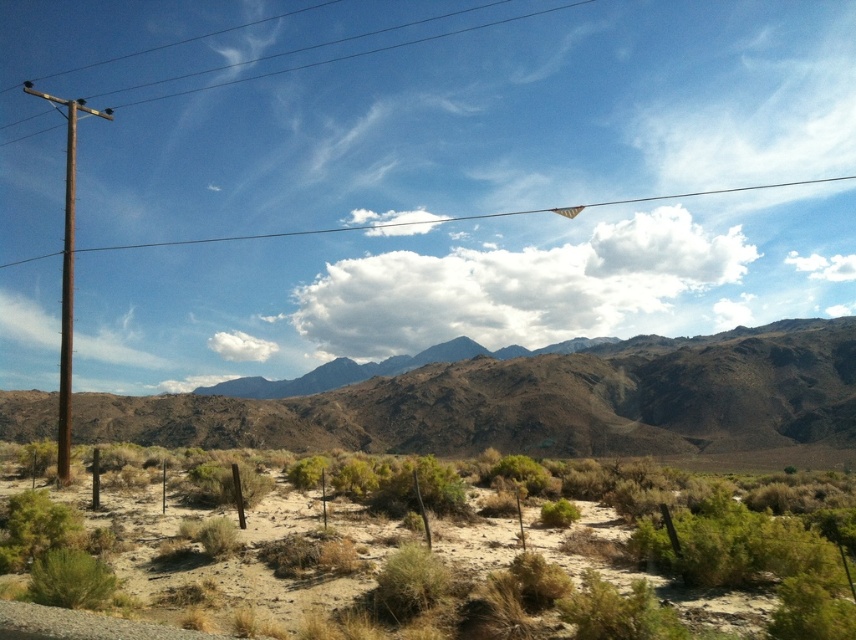
Does green shrubbery at center have a greater height compared to brown rocky mountain range at center?

Incorrect, green shrubbery at center's height is not larger of brown rocky mountain range at center's.

Does point (27, 508) come farther from viewer compared to point (667, 433)?

That is False.

Is point (521, 474) farther from camera compared to point (244, 442)?

No, it is not.

You are a GUI agent. You are given a task and a screenshot of the screen. Output one action in this format:
    pyautogui.click(x=<x>, y=<y>)
    Task: Click on the green shrubbery at center
    The width and height of the screenshot is (856, 640).
    Given the screenshot: What is the action you would take?
    pyautogui.click(x=412, y=554)

Identify the location of rusty wood telegraph pole at left. (66, 273).

Is point (67, 456) in front of point (63, 378)?

That is True.

Find the location of `rusty wood telegraph pole at left`. rusty wood telegraph pole at left is located at coordinates (66, 273).

Is brown rocky mountain range at center positioned in front of rusty wood telegraph pole at left?

No, it is not.

Which is above, brown rocky mountain range at center or rusty wood telegraph pole at left?

rusty wood telegraph pole at left is higher up.

Between point (742, 330) and point (51, 102), which one is positioned behind?

Positioned behind is point (51, 102).

Locate an element on the screen. This screenshot has width=856, height=640. brown rocky mountain range at center is located at coordinates (539, 401).